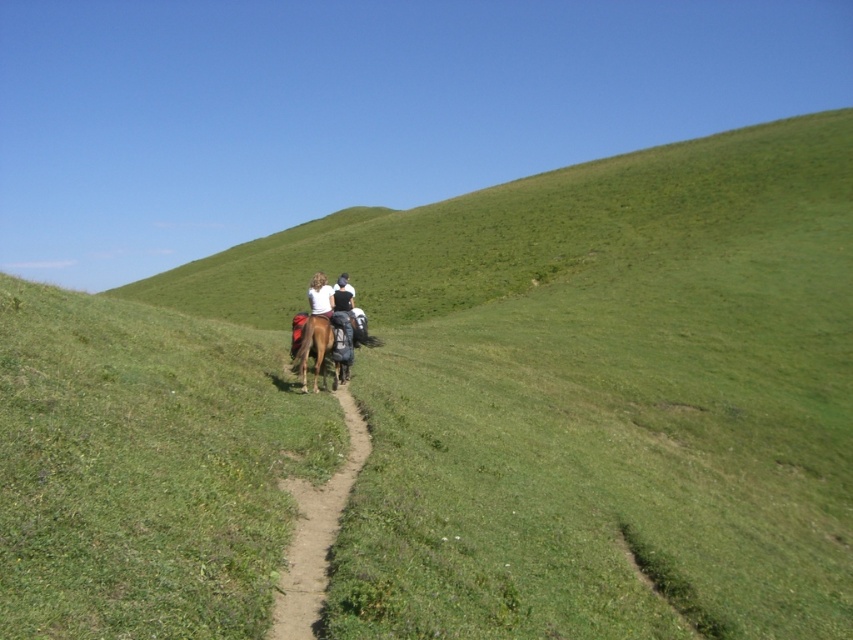
You are a rider on the brown glossy horse at center. You need to navigate through the brown dirt path at center. Can the horse fit through the path without needing to move sideways?

The brown dirt path at center is narrower than the brown glossy horse at center, so the horse cannot fit through the path without moving sideways.

You are a hiker who wants to follow the dirt path. You see the brown glossy horse at center and the brown dirt path at center. Which direction should you go relative to the horse to stay on the path?

To stay on the path, you should go to the right of the brown glossy horse at center since the brown dirt path at center is located to the right of the horse.

You are a hiker trying to cross the brown glossy horse at center that is blocking your way on the brown dirt path at center. Can you walk around the horse on either side?

The brown dirt path at center has a lesser height compared to brown glossy horse at center, so the path is lower than the horse. Since the path is narrow and the horse is taller, you might need to wait for the horse to move or find an alternative route around the obstacle.